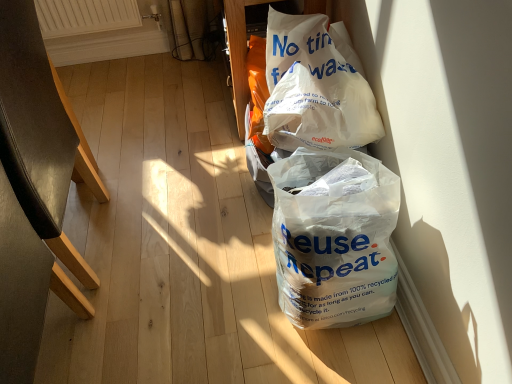
The height and width of the screenshot is (384, 512). Identify the location of free area behind black leather chair at left. (135, 156).